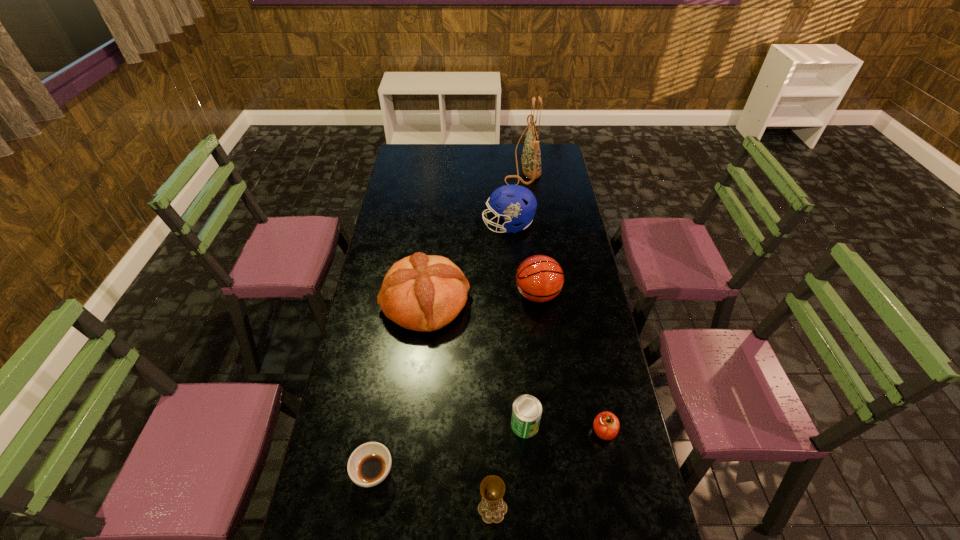
What are the coordinates of `free space between the football helmet and the rightmost object` in the screenshot? It's located at (556, 328).

Locate an element on the screen. This screenshot has height=540, width=960. vacant area that lies between the chalice and the second farthest object is located at coordinates (500, 367).

The height and width of the screenshot is (540, 960). I want to click on free space that is in between the bread and the apple, so click(x=515, y=366).

Locate which object is the second closest to the chalice. Please provide its 2D coordinates. Your answer should be formatted as a tuple, i.e. [(x, y)], where the tuple contains the x and y coordinates of a point satisfying the conditions above.

[(370, 463)]

Choose which object is the seventh nearest neighbor to the fifth tallest object. Please provide its 2D coordinates. Your answer should be formatted as a tuple, i.e. [(x, y)], where the tuple contains the x and y coordinates of a point satisfying the conditions above.

[(531, 156)]

Find the location of a particular element. This screenshot has height=540, width=960. vacant space that satisfies the following two spatial constraints: 1. on the face guard of the football helmet; 2. on the front side of the chalice is located at coordinates (528, 508).

You are a GUI agent. You are given a task and a screenshot of the screen. Output one action in this format:
    pyautogui.click(x=<x>, y=<y>)
    Task: Click on the free spot that satisfies the following two spatial constraints: 1. on the front-facing side of the tallest object; 2. on the front side of the chalice
    This screenshot has width=960, height=540.
    Given the screenshot: What is the action you would take?
    (x=564, y=508)

At what (x,y) coordinates should I click in order to perform the action: click on free space that satisfies the following two spatial constraints: 1. on the front-facing side of the rightmost object; 2. on the right side of the farthest object. Please return your answer as a coordinate pair (x, y). Looking at the image, I should click on (554, 431).

Where is `vacant space that satisfies the following two spatial constraints: 1. on the front side of the third shortest object; 2. on the left side of the rightmost object`? Image resolution: width=960 pixels, height=540 pixels. vacant space that satisfies the following two spatial constraints: 1. on the front side of the third shortest object; 2. on the left side of the rightmost object is located at coordinates (525, 431).

The width and height of the screenshot is (960, 540). I want to click on free spot that satisfies the following two spatial constraints: 1. on the face guard of the football helmet; 2. on the right side of the third shortest object, so click(522, 425).